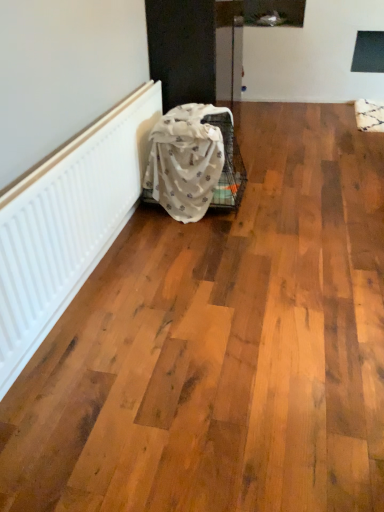
At what (x,y) coordinates should I click in order to perform the action: click on free space in front of white textured fabric at lower left. Please return your answer as a coordinate pair (x, y). The image size is (384, 512). Looking at the image, I should click on (203, 242).